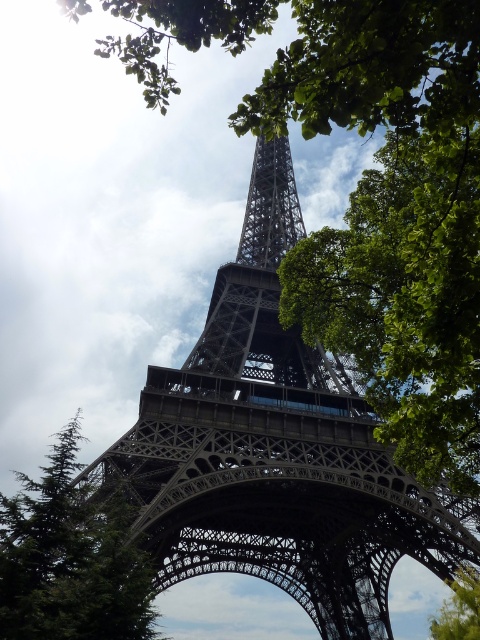
Question: Which object is farther from the camera taking this photo?

Choices:
 (A) green leafy tree at lower right
 (B) green textured tree at lower left
 (C) metallic lattice tower at center
 (D) green leafy tree at center

Answer: (A)

Question: Does metallic lattice tower at center lie behind green leafy tree at lower right?

Choices:
 (A) no
 (B) yes

Answer: (A)

Question: Which object is positioned farthest from the green leafy tree at center?

Choices:
 (A) green leafy tree at lower right
 (B) green textured tree at lower left

Answer: (A)

Question: Can you confirm if metallic lattice tower at center is smaller than green leafy tree at center?

Choices:
 (A) no
 (B) yes

Answer: (A)

Question: Can you confirm if green textured tree at lower left is positioned above green leafy tree at lower right?

Choices:
 (A) no
 (B) yes

Answer: (B)

Question: Estimate the real-world distances between objects in this image. Which object is farther from the green leafy tree at center?

Choices:
 (A) green textured tree at lower left
 (B) metallic lattice tower at center

Answer: (A)